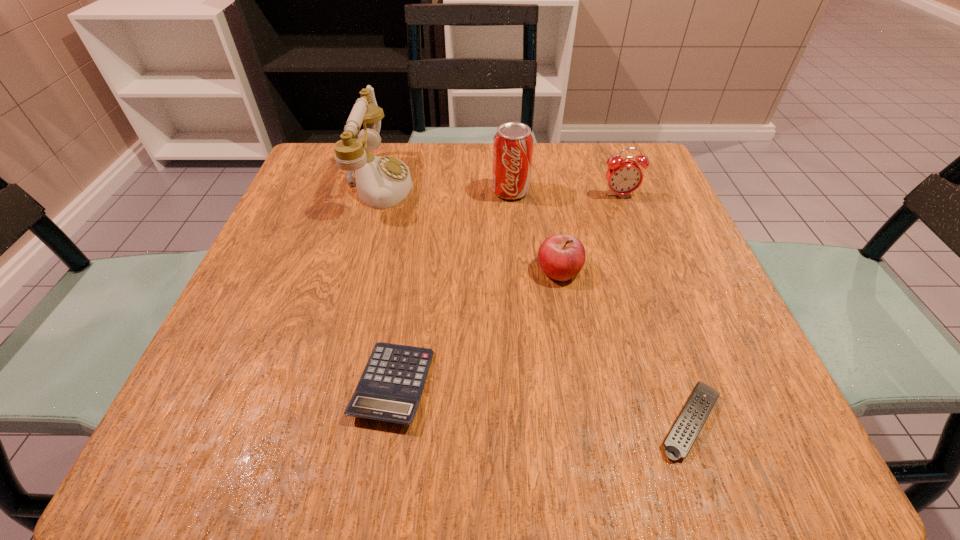
At what (x,y) coordinates should I click in order to perform the action: click on remote control that is at the right edge. Please return your answer as a coordinate pair (x, y). Looking at the image, I should click on point(680,439).

Locate an element on the screen. The height and width of the screenshot is (540, 960). object situated at the far left corner is located at coordinates (382, 182).

At what (x,y) coordinates should I click in order to perform the action: click on object located at the far right corner. Please return your answer as a coordinate pair (x, y). The width and height of the screenshot is (960, 540). Looking at the image, I should click on (624, 176).

Where is `object situated at the near right corner`? Image resolution: width=960 pixels, height=540 pixels. object situated at the near right corner is located at coordinates (680, 439).

In the image, there is a desktop. Identify the location of free space at the far edge. (534, 184).

The height and width of the screenshot is (540, 960). I want to click on free region at the near edge of the desktop, so click(442, 438).

What are the coordinates of `vacant space at the left edge of the desktop` in the screenshot? It's located at (305, 253).

Where is `free space at the right edge`? free space at the right edge is located at coordinates (630, 273).

The image size is (960, 540). I want to click on free region at the far left corner of the desktop, so click(x=316, y=186).

You are a GUI agent. You are given a task and a screenshot of the screen. Output one action in this format:
    pyautogui.click(x=<x>, y=<y>)
    Task: Click on the vacant area at the near left corner
    This screenshot has height=540, width=960.
    Given the screenshot: What is the action you would take?
    pyautogui.click(x=218, y=421)